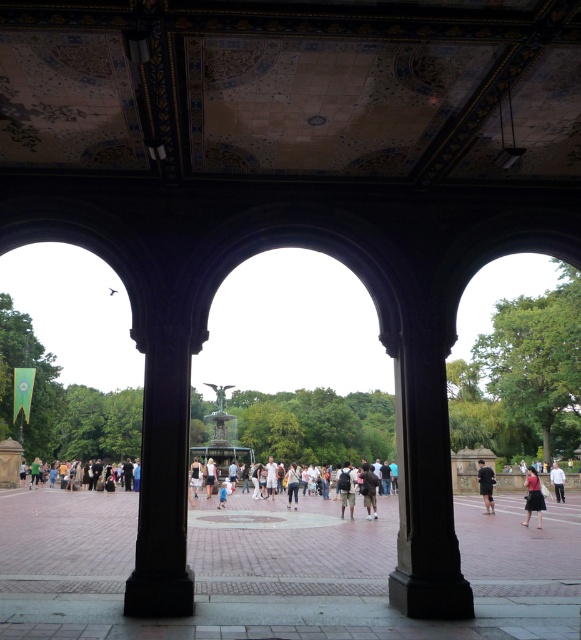
Question: Can you confirm if dark gray backpack at center is positioned to the right of light blue jeans at center?

Choices:
 (A) no
 (B) yes

Answer: (B)

Question: Which is farther from the light blue jeans at center?

Choices:
 (A) light blue denim jeans at center
 (B) matte black dress at lower right
 (C) dark gray fabric dress at center

Answer: (B)

Question: Does dark brown leather backpack at center have a greater width compared to light blue denim jeans at center?

Choices:
 (A) no
 (B) yes

Answer: (B)

Question: Which is nearer to the white cotton shirt at lower right?

Choices:
 (A) dark gray backpack at center
 (B) matte black dress at lower right
 (C) light blue denim jeans at center
 (D) black matte shorts at center

Answer: (B)

Question: Which object is closer to the camera taking this photo?

Choices:
 (A) light blue denim jeans at center
 (B) light blue jeans at center

Answer: (A)

Question: From the image, what is the correct spatial relationship of dark brown leather backpack at center in relation to dark gray backpack at center?

Choices:
 (A) right
 (B) left

Answer: (A)